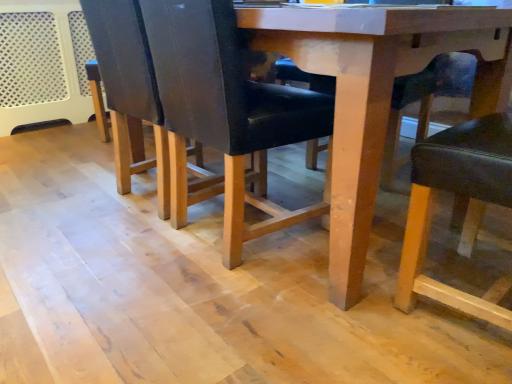
Question: Considering the positions of wooden chair leg at center, the second chair positioned from the front, and matte black chair at lower right, which is the second chair from back to front, in the image, is wooden chair leg at center, the second chair positioned from the front, wider or thinner than matte black chair at lower right, which is the second chair from back to front,?

Choices:
 (A) wide
 (B) thin

Answer: (A)

Question: Looking at the image, does wooden chair leg at center, the first chair in the back-to-front sequence, seem bigger or smaller compared to matte black chair at lower right, which is the second chair from back to front?

Choices:
 (A) small
 (B) big

Answer: (B)

Question: Considering their positions, is wooden chair leg at center, the second chair positioned from the front, located in front of or behind matte black chair at lower right, which ranks as the 1th chair in front-to-back order?

Choices:
 (A) front
 (B) behind

Answer: (B)

Question: Is point (429, 195) positioned closer to the camera than point (419, 127)?

Choices:
 (A) closer
 (B) farther

Answer: (A)

Question: From the image's perspective, is matte black chair at lower right, which is the second chair from back to front, located above or below wooden chair leg at center, the first chair in the back-to-front sequence?

Choices:
 (A) below
 (B) above

Answer: (A)

Question: Is matte black chair at lower right, which ranks as the 1th chair in front-to-back order, bigger or smaller than wooden chair leg at center, the first chair in the back-to-front sequence?

Choices:
 (A) small
 (B) big

Answer: (A)

Question: Is matte black chair at lower right, which ranks as the 1th chair in front-to-back order, situated inside wooden chair leg at center, the second chair positioned from the front, or outside?

Choices:
 (A) inside
 (B) outside

Answer: (B)